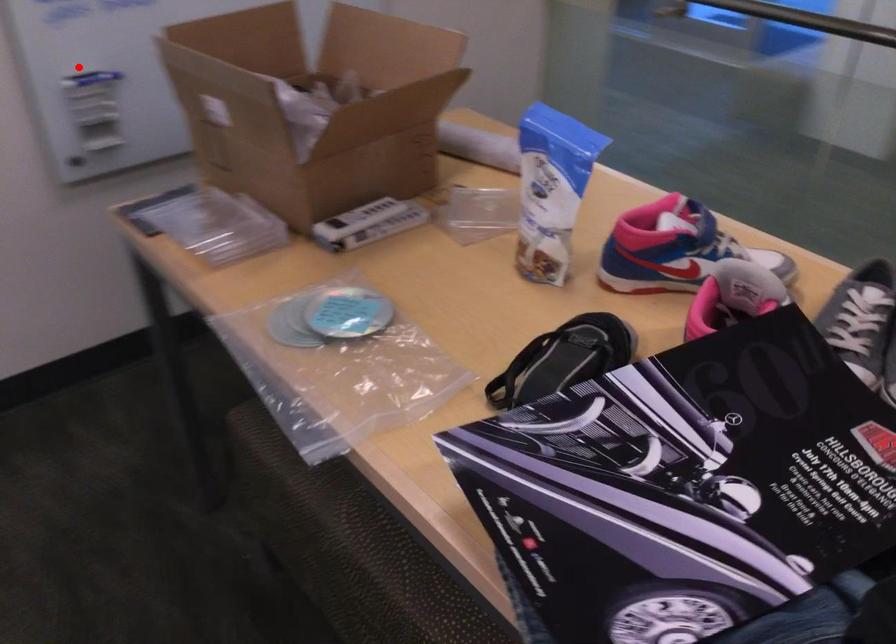
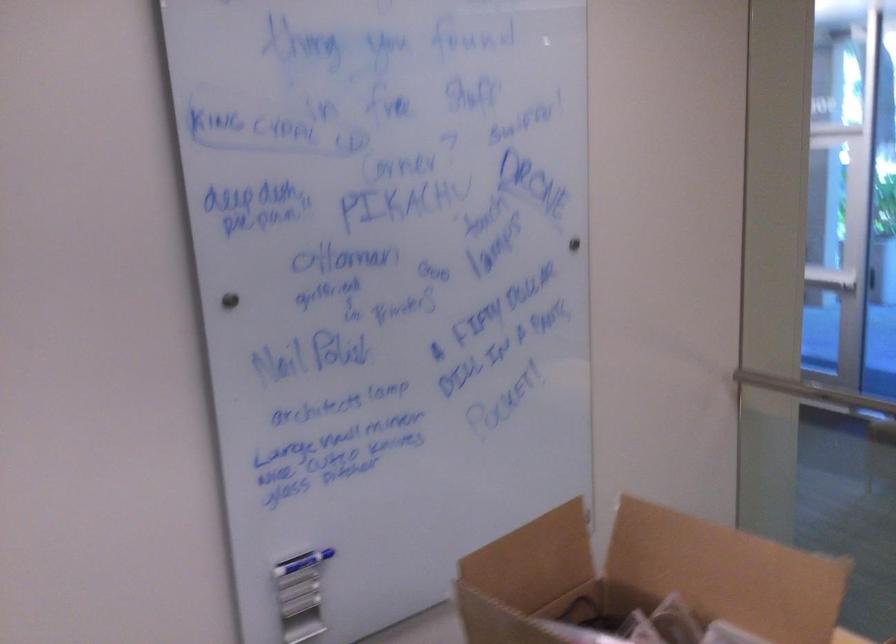
Question: I am providing you with two images of the same scene from different viewpoints. Image1 has a red point marked. In image2, the corresponding 3D location appears at what relative position? Reply with the corresponding letter.

Choices:
 (A) Closer
 (B) Farther

Answer: (A)